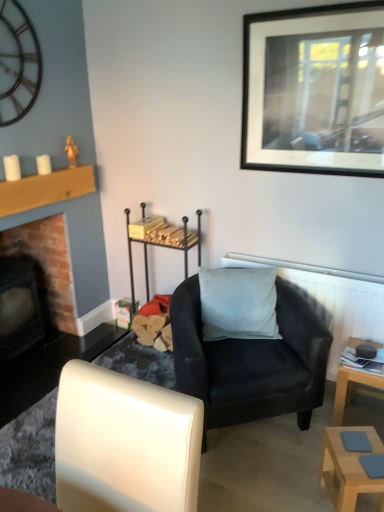
Where is `free point below black matte picture frame at upper right (from a real-world perspective)`? free point below black matte picture frame at upper right (from a real-world perspective) is located at coordinates (307, 258).